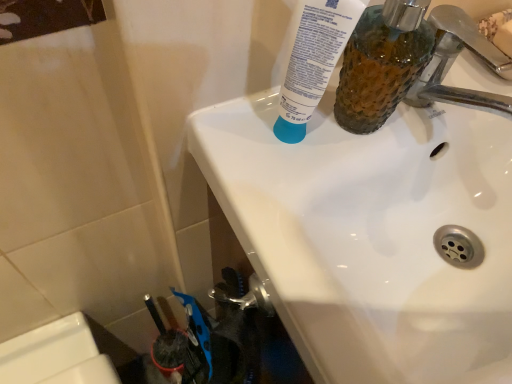
Question: Considering the relative positions of translucent textured mouthwash at upper right and white matte tube at upper center in the image provided, is translucent textured mouthwash at upper right to the left of white matte tube at upper center from the viewer's perspective?

Choices:
 (A) yes
 (B) no

Answer: (B)

Question: From a real-world perspective, is translucent textured mouthwash at upper right located beneath white matte tube at upper center?

Choices:
 (A) no
 (B) yes

Answer: (A)

Question: Is translucent textured mouthwash at upper right facing away from white matte tube at upper center?

Choices:
 (A) no
 (B) yes

Answer: (A)

Question: From a real-world perspective, is translucent textured mouthwash at upper right over white matte tube at upper center?

Choices:
 (A) yes
 (B) no

Answer: (A)

Question: Considering the relative sizes of translucent textured mouthwash at upper right and white matte tube at upper center in the image provided, is translucent textured mouthwash at upper right smaller than white matte tube at upper center?

Choices:
 (A) yes
 (B) no

Answer: (B)

Question: Considering the relative positions of translucent textured mouthwash at upper right and white matte tube at upper center in the image provided, is translucent textured mouthwash at upper right to the right of white matte tube at upper center from the viewer's perspective?

Choices:
 (A) yes
 (B) no

Answer: (A)

Question: Is chrome metallic faucet at upper right to the left of translucent textured mouthwash at upper right from the viewer's perspective?

Choices:
 (A) yes
 (B) no

Answer: (B)

Question: Is the position of chrome metallic faucet at upper right less distant than that of translucent textured mouthwash at upper right?

Choices:
 (A) no
 (B) yes

Answer: (A)

Question: Considering the relative sizes of chrome metallic faucet at upper right and translucent textured mouthwash at upper right in the image provided, is chrome metallic faucet at upper right taller than translucent textured mouthwash at upper right?

Choices:
 (A) yes
 (B) no

Answer: (B)

Question: Is chrome metallic faucet at upper right beside translucent textured mouthwash at upper right?

Choices:
 (A) yes
 (B) no

Answer: (A)

Question: Can you confirm if chrome metallic faucet at upper right is wider than translucent textured mouthwash at upper right?

Choices:
 (A) no
 (B) yes

Answer: (B)

Question: Can you confirm if chrome metallic faucet at upper right is smaller than translucent textured mouthwash at upper right?

Choices:
 (A) yes
 (B) no

Answer: (A)

Question: Are translucent textured mouthwash at upper right and white glossy sink at upper center far apart?

Choices:
 (A) no
 (B) yes

Answer: (A)